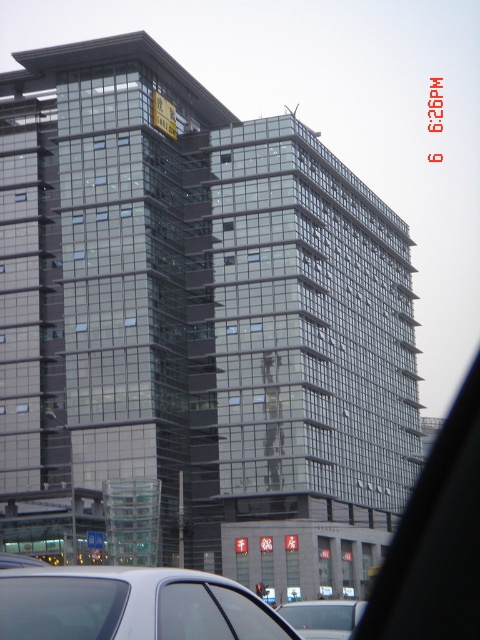
Is point (72, 627) positioned in front of point (287, 636)?

Yes, it is.

Is the position of silver metallic car at lower left more distant than that of transparent glass car window at lower center?

That is False.

Which is behind, point (119, 618) or point (257, 608)?

Point (257, 608)

Where is `silver metallic car at lower left`? This screenshot has width=480, height=640. silver metallic car at lower left is located at coordinates (131, 605).

This screenshot has height=640, width=480. Find the location of `transparent glass car window at lower left`. transparent glass car window at lower left is located at coordinates (60, 605).

Who is more distant from viewer, [44,588] or [250,628]?

Point [250,628]

The width and height of the screenshot is (480, 640). Find the location of `transparent glass car window at lower left`. transparent glass car window at lower left is located at coordinates (60, 605).

Is point (97, 584) positioned behind point (118, 625)?

Yes, point (97, 584) is behind point (118, 625).

Is silver metallic car at lower left behind transparent glass car window at lower left?

That is True.

The image size is (480, 640). What do you see at coordinates (131, 605) in the screenshot?
I see `silver metallic car at lower left` at bounding box center [131, 605].

I want to click on silver metallic car at lower left, so click(x=131, y=605).